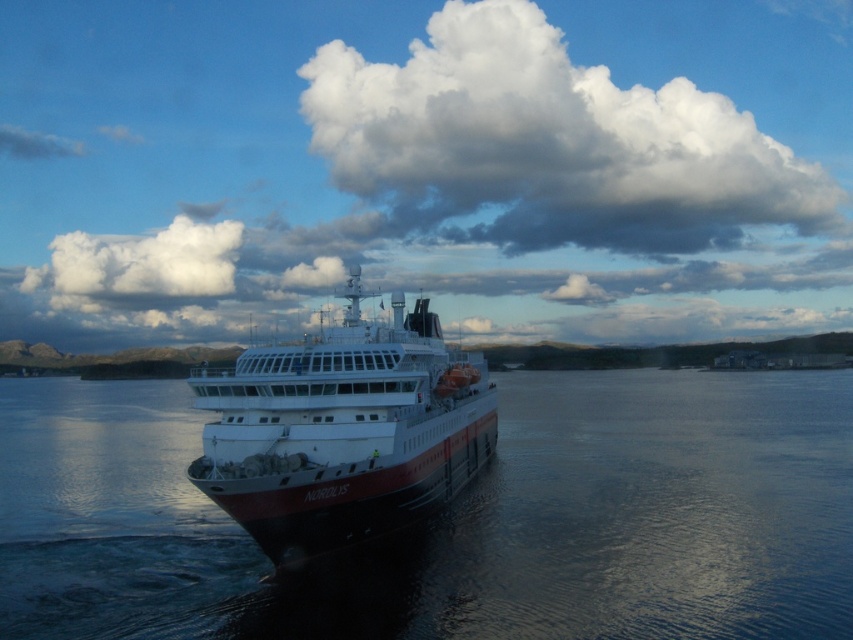
You are a pilot flying a small aircraft and want to avoid obstacles. You notice the glossy water at center and the white fluffy cloud at upper center in your view. Which object is closer to your aircraft?

The glossy water at center is closer to your aircraft than the white fluffy cloud at upper center because the distance between them is 178.65 meters.

You are a photographer on the deck of the white glossy ship at center, aiming to capture the white fluffy cloud at upper center in your shot. Based on their positions, which object is located to the right of the other?

The white fluffy cloud at upper center is positioned on the right side of white glossy ship at center, so the white fluffy cloud at upper center is to the right of the white glossy ship at center.

You are standing on the deck of the white glossy ship at center. Looking out, you see the glossy water at center. Which object is closer to you?

The glossy water at center is closer to you than the white glossy ship at center.